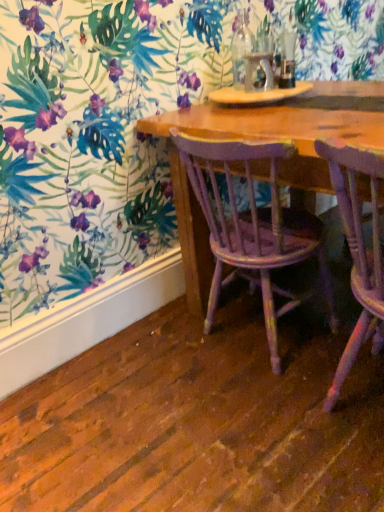
I want to click on distressed purple wood chair at center, arranged as the second chair when viewed from the right, so coord(253,229).

This screenshot has width=384, height=512. Describe the element at coordinates (253, 229) in the screenshot. I see `distressed purple wood chair at center, the first chair in the left-to-right sequence` at that location.

Measure the distance between distressed purple wood chair at center, arranged as the second chair when viewed from the right, and camera.

distressed purple wood chair at center, arranged as the second chair when viewed from the right, and camera are 1.05 meters apart from each other.

How much space does purple painted wood chair at lower right, the first chair viewed from the right, occupy horizontally?

purple painted wood chair at lower right, the first chair viewed from the right, is 18.46 inches wide.

This screenshot has width=384, height=512. What do you see at coordinates (358, 250) in the screenshot?
I see `purple painted wood chair at lower right, positioned as the second chair in left-to-right order` at bounding box center [358, 250].

Find the location of a particular element. This screenshot has width=384, height=512. purple painted wood chair at lower right, positioned as the second chair in left-to-right order is located at coordinates [x=358, y=250].

The image size is (384, 512). In order to click on distressed purple wood chair at center, the first chair in the left-to-right sequence in this screenshot , I will do `click(253, 229)`.

In the scene shown: Would you say purple painted wood chair at lower right, positioned as the second chair in left-to-right order, is to the left or to the right of distressed purple wood chair at center, arranged as the second chair when viewed from the right, in the picture?

purple painted wood chair at lower right, positioned as the second chair in left-to-right order, is positioned on distressed purple wood chair at center, arranged as the second chair when viewed from the right,'s right side.

Which is in front, purple painted wood chair at lower right, the first chair viewed from the right, or distressed purple wood chair at center, the first chair in the left-to-right sequence?

purple painted wood chair at lower right, the first chair viewed from the right, is more forward.

Considering the positions of points (343, 150) and (296, 236), is point (343, 150) closer to camera compared to point (296, 236)?

Yes, point (343, 150) is in front of point (296, 236).

From the image's perspective, which is above, purple painted wood chair at lower right, positioned as the second chair in left-to-right order, or distressed purple wood chair at center, the first chair in the left-to-right sequence?

distressed purple wood chair at center, the first chair in the left-to-right sequence, from the image's perspective.

From a real-world perspective, is purple painted wood chair at lower right, the first chair viewed from the right, physically located above or below distressed purple wood chair at center, the first chair in the left-to-right sequence?

Clearly, from a real-world perspective, purple painted wood chair at lower right, the first chair viewed from the right, is above distressed purple wood chair at center, the first chair in the left-to-right sequence.

Which of these two, purple painted wood chair at lower right, the first chair viewed from the right, or distressed purple wood chair at center, the first chair in the left-to-right sequence, is thinner?

distressed purple wood chair at center, the first chair in the left-to-right sequence, is thinner.

Considering the sizes of objects purple painted wood chair at lower right, the first chair viewed from the right, and distressed purple wood chair at center, the first chair in the left-to-right sequence, in the image provided, who is shorter, purple painted wood chair at lower right, the first chair viewed from the right, or distressed purple wood chair at center, the first chair in the left-to-right sequence,?

distressed purple wood chair at center, the first chair in the left-to-right sequence, is shorter.

Considering the sizes of objects purple painted wood chair at lower right, positioned as the second chair in left-to-right order, and distressed purple wood chair at center, the first chair in the left-to-right sequence, in the image provided, who is bigger, purple painted wood chair at lower right, positioned as the second chair in left-to-right order, or distressed purple wood chair at center, the first chair in the left-to-right sequence,?

With larger size is distressed purple wood chair at center, the first chair in the left-to-right sequence.

Is purple painted wood chair at lower right, positioned as the second chair in left-to-right order, located outside distressed purple wood chair at center, arranged as the second chair when viewed from the right?

Yes.

Is purple painted wood chair at lower right, the first chair viewed from the right, directly adjacent to distressed purple wood chair at center, arranged as the second chair when viewed from the right?

No, purple painted wood chair at lower right, the first chair viewed from the right, is not touching distressed purple wood chair at center, arranged as the second chair when viewed from the right.

Is purple painted wood chair at lower right, the first chair viewed from the right, oriented towards distressed purple wood chair at center, arranged as the second chair when viewed from the right?

No, purple painted wood chair at lower right, the first chair viewed from the right, is not turned towards distressed purple wood chair at center, arranged as the second chair when viewed from the right.

Can you tell me how much purple painted wood chair at lower right, the first chair viewed from the right, and distressed purple wood chair at center, the first chair in the left-to-right sequence, differ in facing direction?

purple painted wood chair at lower right, the first chair viewed from the right, and distressed purple wood chair at center, the first chair in the left-to-right sequence, are facing 6.34 degrees away from each other.

Measure the distance between purple painted wood chair at lower right, the first chair viewed from the right, and distressed purple wood chair at center, the first chair in the left-to-right sequence.

purple painted wood chair at lower right, the first chair viewed from the right, is 13.45 inches away from distressed purple wood chair at center, the first chair in the left-to-right sequence.

I want to click on chair to the left of purple painted wood chair at lower right, the first chair viewed from the right, so click(253, 229).

Which is more to the left, distressed purple wood chair at center, the first chair in the left-to-right sequence, or purple painted wood chair at lower right, positioned as the second chair in left-to-right order?

distressed purple wood chair at center, the first chair in the left-to-right sequence.

Is distressed purple wood chair at center, arranged as the second chair when viewed from the right, positioned in front of purple painted wood chair at lower right, positioned as the second chair in left-to-right order?

No, distressed purple wood chair at center, arranged as the second chair when viewed from the right, is further to the viewer.

Is point (237, 217) closer or farther from the camera than point (373, 318)?

Point (237, 217).

From the image's perspective, is distressed purple wood chair at center, the first chair in the left-to-right sequence, below purple painted wood chair at lower right, the first chair viewed from the right?

No.

From a real-world perspective, who is located lower, distressed purple wood chair at center, arranged as the second chair when viewed from the right, or purple painted wood chair at lower right, positioned as the second chair in left-to-right order?

distressed purple wood chair at center, arranged as the second chair when viewed from the right.

Which object is wider, distressed purple wood chair at center, the first chair in the left-to-right sequence, or purple painted wood chair at lower right, the first chair viewed from the right?

purple painted wood chair at lower right, the first chair viewed from the right, is wider.

Considering the sizes of objects distressed purple wood chair at center, arranged as the second chair when viewed from the right, and purple painted wood chair at lower right, the first chair viewed from the right, in the image provided, who is taller, distressed purple wood chair at center, arranged as the second chair when viewed from the right, or purple painted wood chair at lower right, the first chair viewed from the right,?

purple painted wood chair at lower right, the first chair viewed from the right.

Is distressed purple wood chair at center, the first chair in the left-to-right sequence, smaller than purple painted wood chair at lower right, the first chair viewed from the right?

Incorrect, distressed purple wood chair at center, the first chair in the left-to-right sequence, is not smaller in size than purple painted wood chair at lower right, the first chair viewed from the right.

In the scene shown: Is distressed purple wood chair at center, the first chair in the left-to-right sequence, completely or partially outside of purple painted wood chair at lower right, positioned as the second chair in left-to-right order?

Yes.

Is distressed purple wood chair at center, arranged as the second chair when viewed from the right, next to purple painted wood chair at lower right, positioned as the second chair in left-to-right order, and touching it?

No, distressed purple wood chair at center, arranged as the second chair when viewed from the right, is not next to purple painted wood chair at lower right, positioned as the second chair in left-to-right order.

Is purple painted wood chair at lower right, positioned as the second chair in left-to-right order, at the back of distressed purple wood chair at center, the first chair in the left-to-right sequence?

No, purple painted wood chair at lower right, positioned as the second chair in left-to-right order, is not at the back of distressed purple wood chair at center, the first chair in the left-to-right sequence.

Where is `chair that is on the left side of purple painted wood chair at lower right, positioned as the second chair in left-to-right order`? Image resolution: width=384 pixels, height=512 pixels. chair that is on the left side of purple painted wood chair at lower right, positioned as the second chair in left-to-right order is located at coordinates (253, 229).

The image size is (384, 512). Find the location of `chair located in front of the distressed purple wood chair at center, the first chair in the left-to-right sequence`. chair located in front of the distressed purple wood chair at center, the first chair in the left-to-right sequence is located at coordinates (358, 250).

Where is `chair above the purple painted wood chair at lower right, positioned as the second chair in left-to-right order (from the image's perspective)`? chair above the purple painted wood chair at lower right, positioned as the second chair in left-to-right order (from the image's perspective) is located at coordinates (253, 229).